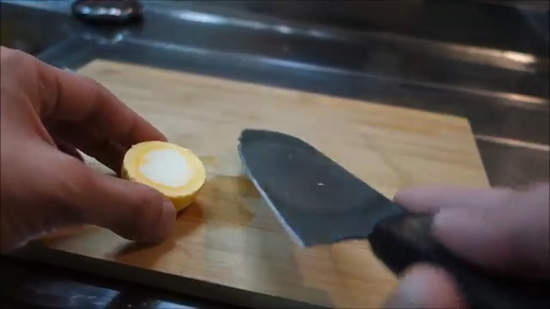
This screenshot has height=309, width=550. What are the coordinates of `counter top` in the screenshot? It's located at (466, 89).